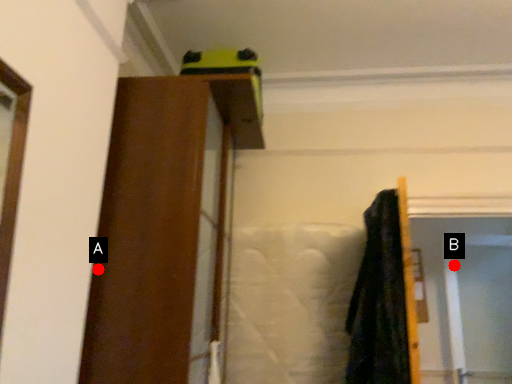
Question: Two points are circled on the image, labeled by A and B beside each circle. Which point is further to the camera?

Choices:
 (A) A is further
 (B) B is further

Answer: (B)